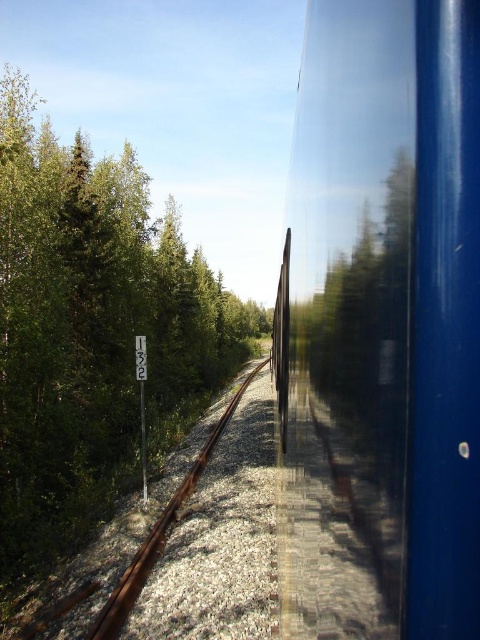
Question: Is the position of glossy blue train at right less distant than that of rusty metal train track at center?

Choices:
 (A) yes
 (B) no

Answer: (A)

Question: Based on their relative distances, which object is farther from the glossy blue train at right?

Choices:
 (A) rusty metal train track at center
 (B) green leafy trees at left

Answer: (B)

Question: Is green leafy trees at left below rusty metal train track at center?

Choices:
 (A) yes
 (B) no

Answer: (B)

Question: Which of the following is the farthest from the observer?

Choices:
 (A) (120, 316)
 (B) (99, 632)
 (C) (455, 612)

Answer: (A)

Question: Which is farther from the green leafy trees at left?

Choices:
 (A) glossy blue train at right
 (B) rusty metal train track at center

Answer: (A)

Question: Is green leafy trees at left closer to the viewer compared to rusty metal train track at center?

Choices:
 (A) yes
 (B) no

Answer: (B)